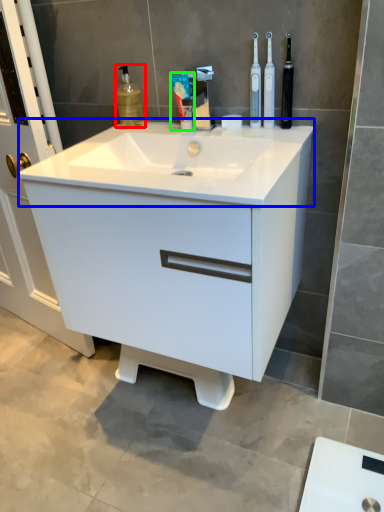
Question: Considering the real-world distances, which object is closest to cleaning product (highlighted by a red box)? counter top (highlighted by a blue box) or toothpaste (highlighted by a green box).

Choices:
 (A) counter top
 (B) toothpaste

Answer: (B)